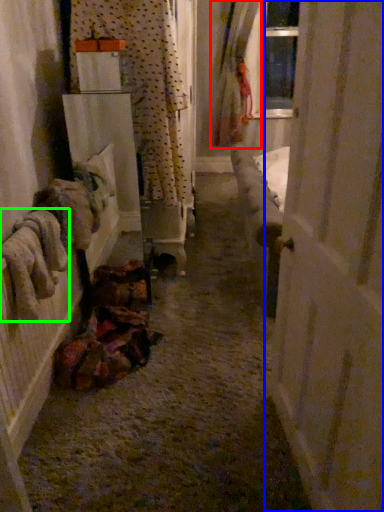
Question: Which object is positioned farthest from curtain (highlighted by a red box)? Select from door (highlighted by a blue box) and clothing (highlighted by a green box).

Choices:
 (A) door
 (B) clothing

Answer: (A)